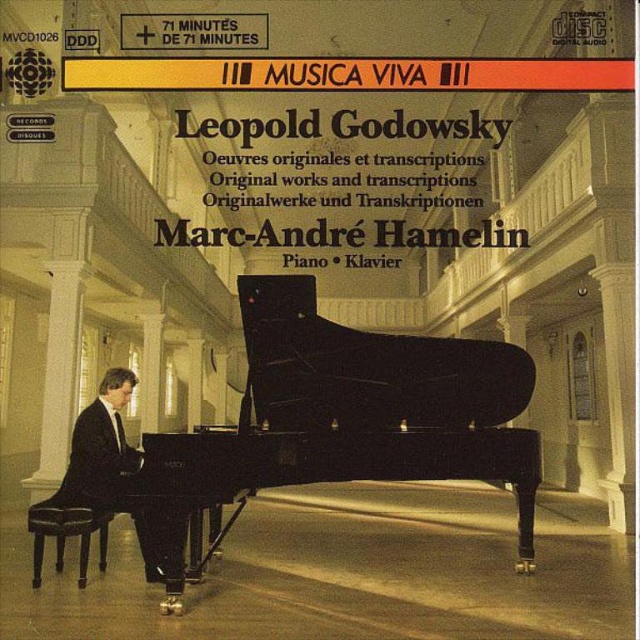
Question: Considering the relative positions of black polished piano at center and black suit at left in the image provided, where is black polished piano at center located with respect to black suit at left?

Choices:
 (A) right
 (B) left

Answer: (A)

Question: Which object is closer to the camera taking this photo?

Choices:
 (A) black suit at left
 (B) black polished piano at center

Answer: (B)

Question: Which object appears farthest from the camera in this image?

Choices:
 (A) black suit at left
 (B) black polished piano at center

Answer: (A)

Question: Does black polished piano at center appear on the right side of black suit at left?

Choices:
 (A) yes
 (B) no

Answer: (A)

Question: Which of the following is the farthest from the observer?

Choices:
 (A) black suit at left
 (B) black polished piano at center

Answer: (A)

Question: From the image, what is the correct spatial relationship of black polished piano at center in relation to black suit at left?

Choices:
 (A) above
 (B) below

Answer: (A)